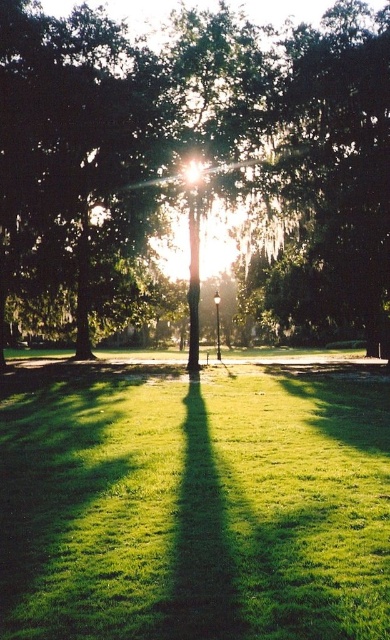
Is green leafy tree at center smaller than green grassy at center?

Incorrect, green leafy tree at center is not smaller in size than green grassy at center.

Which is in front, point (273, 134) or point (148, 515)?

Point (148, 515) is more forward.

Identify the location of green leafy tree at center. (189, 154).